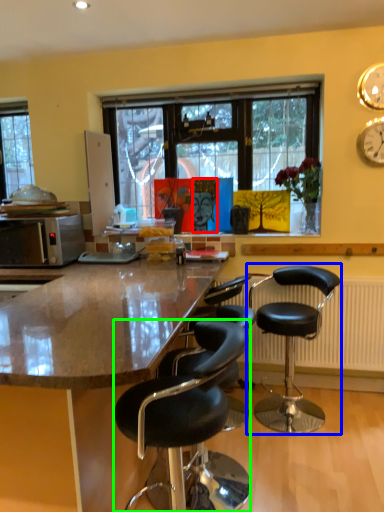
Question: Which object is positioned closest to person (highlighted by a red box)? Select from chair (highlighted by a blue box) and chair (highlighted by a green box).

Choices:
 (A) chair
 (B) chair

Answer: (A)